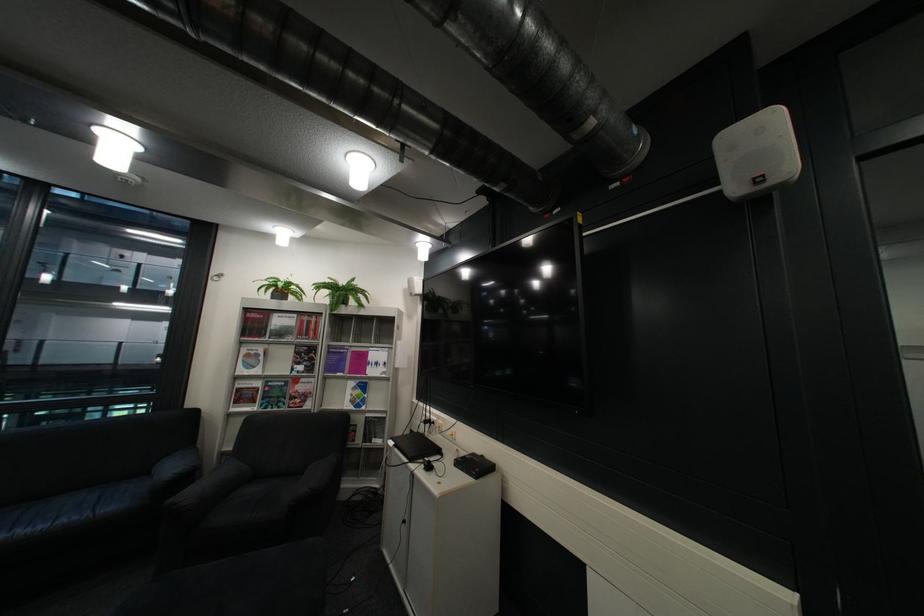
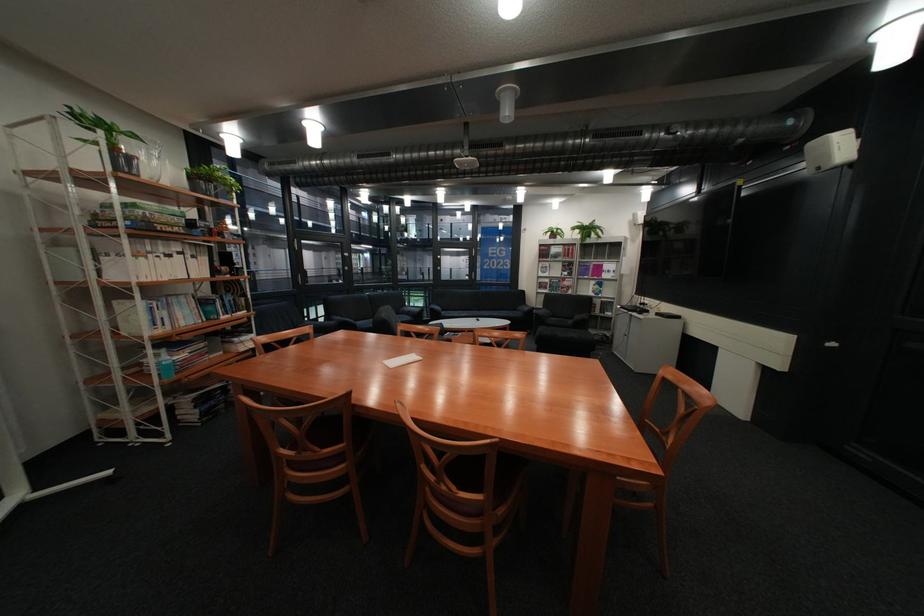
Where in the second image is the point corresponding to point (284, 286) from the first image?

(562, 233)